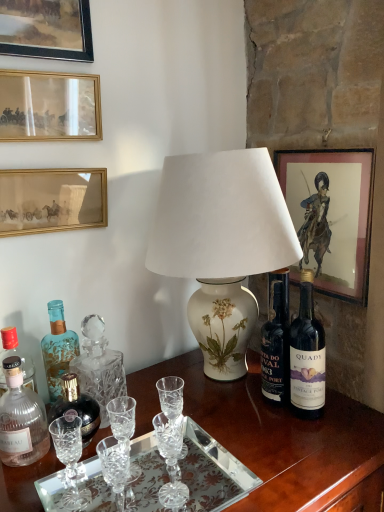
At what (x,y) coordinates should I click in order to perform the action: click on free spot to the right of blue glass bottle at left, the first bottle positioned from the back. Please return your answer as a coordinate pair (x, y). The height and width of the screenshot is (512, 384). Looking at the image, I should click on (134, 411).